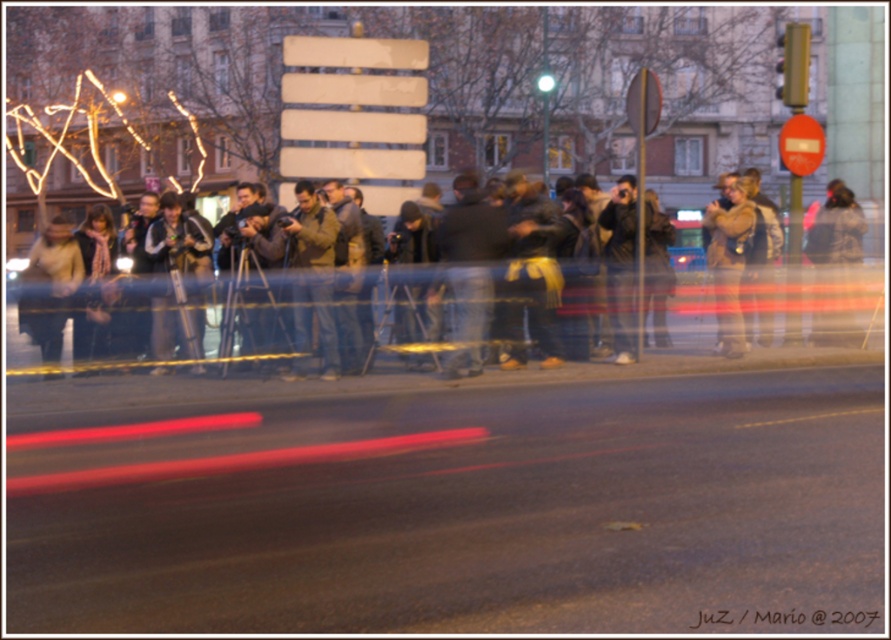
You are a photographer trying to move from your position at the left side of the barrier to the space between the dark brown jacket at center and the brown leather jacket at right. The barrier is narrow. Can you fit through the space between them?

The dark brown jacket at center might be wider than brown leather jacket at right, so the space between them may not be wide enough for you to pass through comfortably. You should check the actual distance before attempting to move through.

You are a photographer standing behind the barrier in the image. You notice two jackets among the crowd. The jackets are labeled as dark brown jacket at center and brown leather jacket at right. Which jacket is positioned more to the left?

The dark brown jacket at center is positioned to the right of the brown leather jacket at right, so the brown leather jacket at right is more to the left.